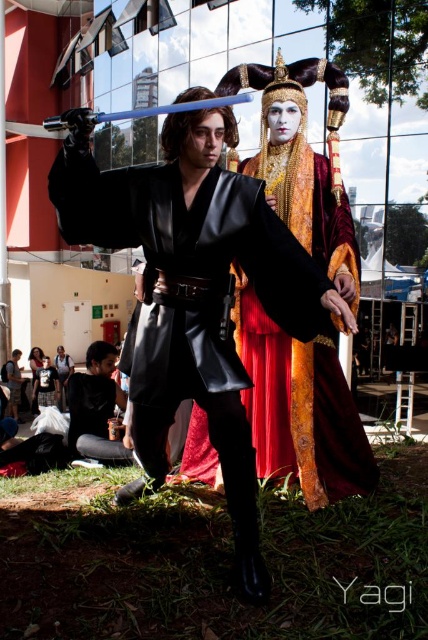
Question: Which of the following is the closest to the observer?

Choices:
 (A) black leather kimono at center
 (B) matte black kimono at center

Answer: (A)

Question: Is matte black kimono at center to the left of smooth gold dress at center from the viewer's perspective?

Choices:
 (A) no
 (B) yes

Answer: (A)

Question: Is black leather jacket at lower left thinner than matte black dress at lower left?

Choices:
 (A) no
 (B) yes

Answer: (A)

Question: Which object is farther from the camera taking this photo?

Choices:
 (A) matte black dress at lower left
 (B) black leather kimono at center
 (C) matte black kimono at center

Answer: (A)

Question: Which object is closer to the camera taking this photo?

Choices:
 (A) smooth gold dress at center
 (B) black leather jacket at lower left
 (C) matte black kimono at center
 (D) black leather kimono at center

Answer: (D)

Question: Is black leather kimono at center above smooth gold dress at center?

Choices:
 (A) yes
 (B) no

Answer: (A)